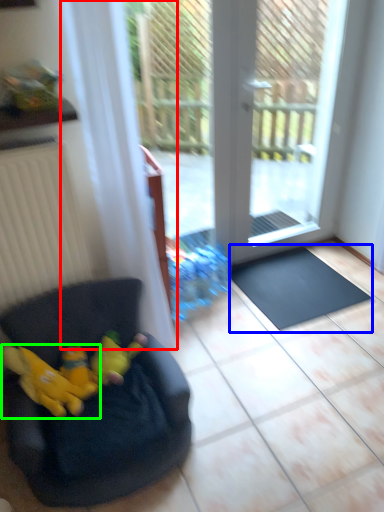
Question: Estimate the real-world distances between objects in this image. Which object is closer to curtain (highlighted by a red box), doormat (highlighted by a blue box) or animal (highlighted by a green box)?

Choices:
 (A) doormat
 (B) animal

Answer: (B)